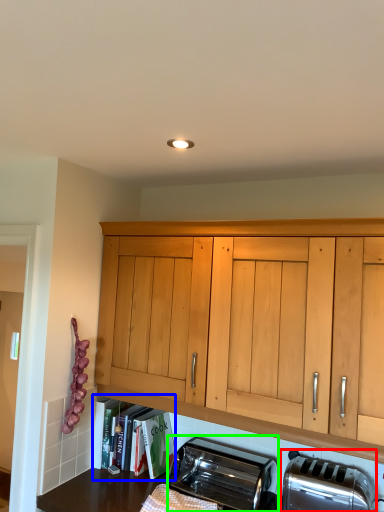
Question: Based on their relative distances, which object is farther from toaster (highlighted by a red box)? Choose from shelf (highlighted by a blue box) and toaster (highlighted by a green box).

Choices:
 (A) shelf
 (B) toaster

Answer: (A)